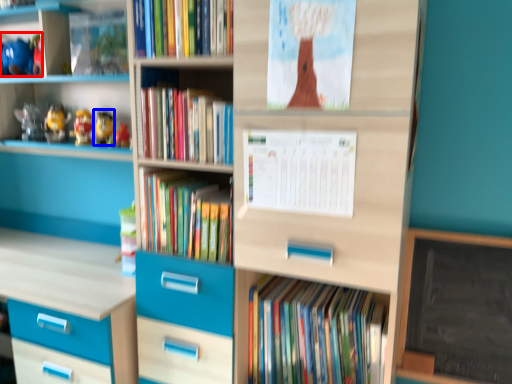
Question: Which of the following is the farthest to the observer, toy (highlighted by a red box) or toy (highlighted by a blue box)?

Choices:
 (A) toy
 (B) toy

Answer: (A)